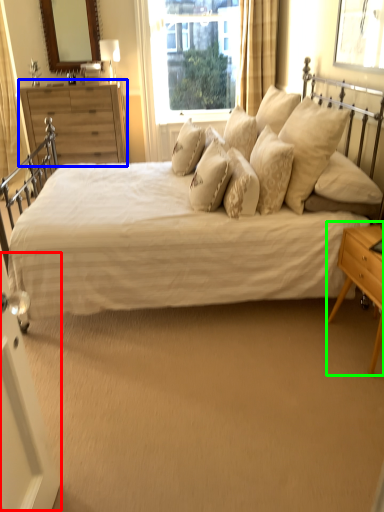
Question: Considering the real-world distances, which object is farthest from screen door (highlighted by a red box)? chest of drawers (highlighted by a blue box) or nightstand (highlighted by a green box)?

Choices:
 (A) chest of drawers
 (B) nightstand

Answer: (A)